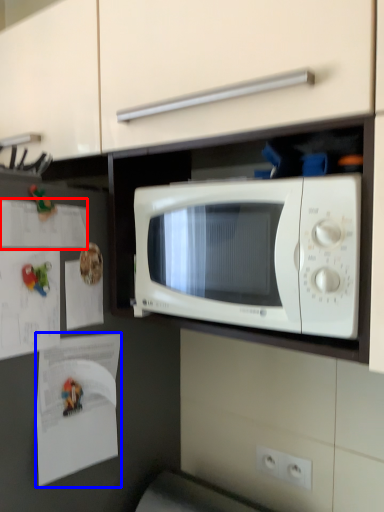
Question: Which object is further to the camera taking this photo, paper (highlighted by a red box) or paper (highlighted by a blue box)?

Choices:
 (A) paper
 (B) paper

Answer: (B)